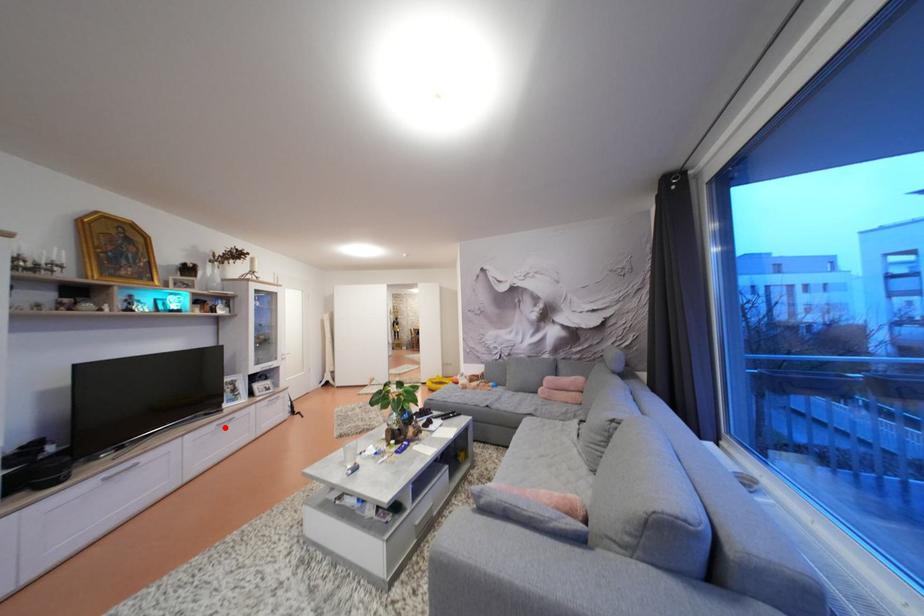
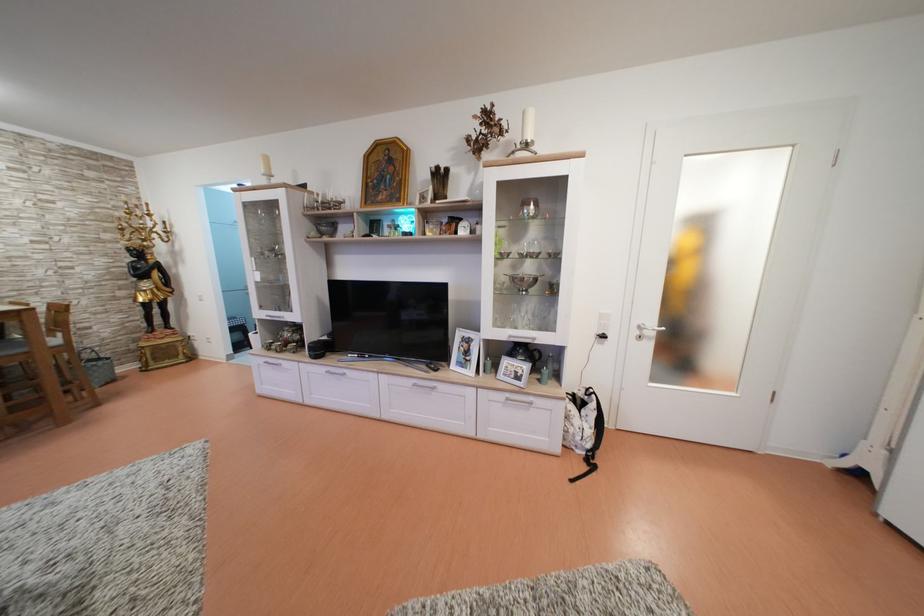
Question: I am providing you with two images of the same scene from different viewpoints. In image1, a red point is highlighted. Considering the same 3D point in image2, which of the following is correct?

Choices:
 (A) It is closer
 (B) It is farther

Answer: (B)